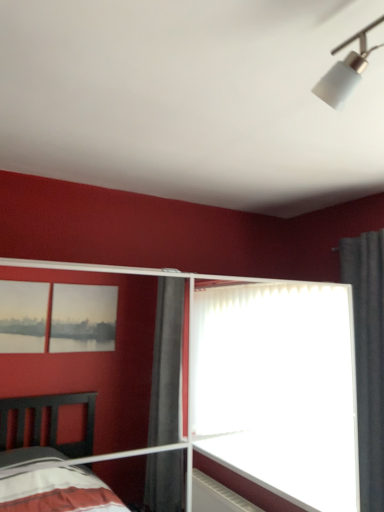
Question: From the image's perspective, is transparent glass door at center located beneath gray fabric curtain at right?

Choices:
 (A) yes
 (B) no

Answer: (A)

Question: Does transparent glass door at center appear on the right side of gray fabric curtain at right?

Choices:
 (A) yes
 (B) no

Answer: (B)

Question: Considering the relative positions of transparent glass door at center and gray fabric curtain at right in the image provided, is transparent glass door at center to the left of gray fabric curtain at right from the viewer's perspective?

Choices:
 (A) no
 (B) yes

Answer: (B)

Question: From a real-world perspective, is transparent glass door at center below gray fabric curtain at right?

Choices:
 (A) yes
 (B) no

Answer: (A)

Question: Is gray fabric curtain at right at the back of transparent glass door at center?

Choices:
 (A) yes
 (B) no

Answer: (B)

Question: Is transparent glass door at center far away from gray fabric curtain at right?

Choices:
 (A) no
 (B) yes

Answer: (A)

Question: Does gray fabric curtain at right have a lesser width compared to transparent glass door at center?

Choices:
 (A) no
 (B) yes

Answer: (B)

Question: Is gray fabric curtain at right outside of transparent glass door at center?

Choices:
 (A) yes
 (B) no

Answer: (A)

Question: Can you confirm if gray fabric curtain at right is taller than transparent glass door at center?

Choices:
 (A) no
 (B) yes

Answer: (B)

Question: From a real-world perspective, is gray fabric curtain at right on transparent glass door at center?

Choices:
 (A) yes
 (B) no

Answer: (A)

Question: Is gray fabric curtain at right shorter than transparent glass door at center?

Choices:
 (A) no
 (B) yes

Answer: (A)

Question: Does gray fabric curtain at right have a smaller size compared to transparent glass door at center?

Choices:
 (A) yes
 (B) no

Answer: (A)

Question: In terms of width, does transparent glass door at center look wider or thinner when compared to gray fabric curtain at right?

Choices:
 (A) thin
 (B) wide

Answer: (B)